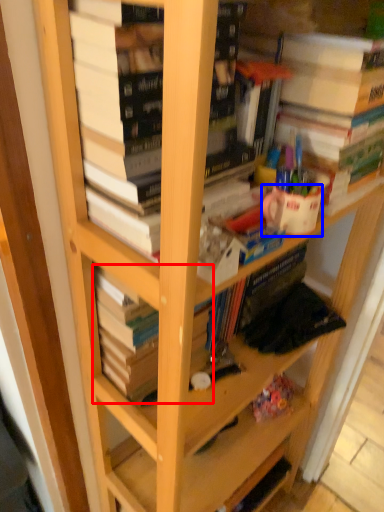
Question: Which object appears closest to the camera in this image, book (highlighted by a red box) or coffee cup (highlighted by a blue box)?

Choices:
 (A) book
 (B) coffee cup

Answer: (A)